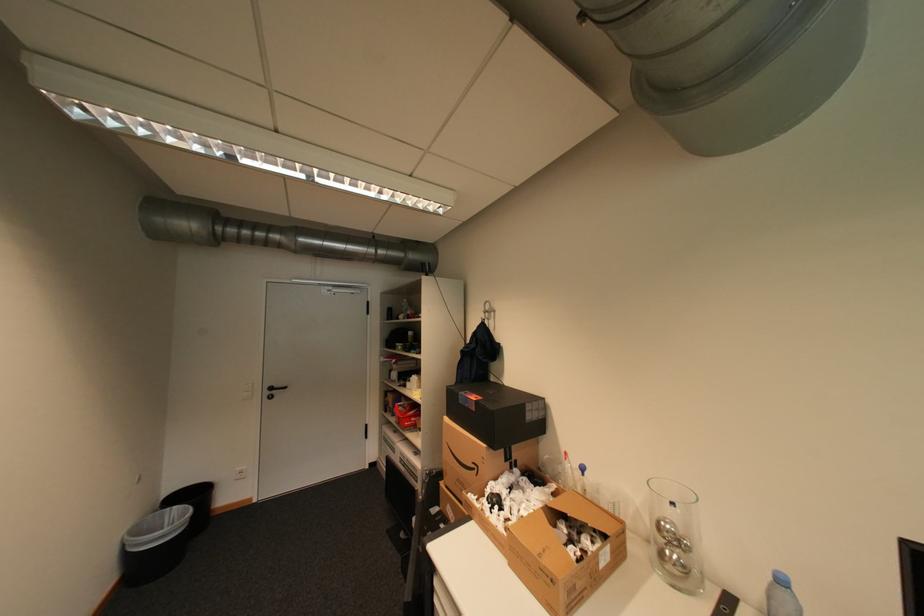
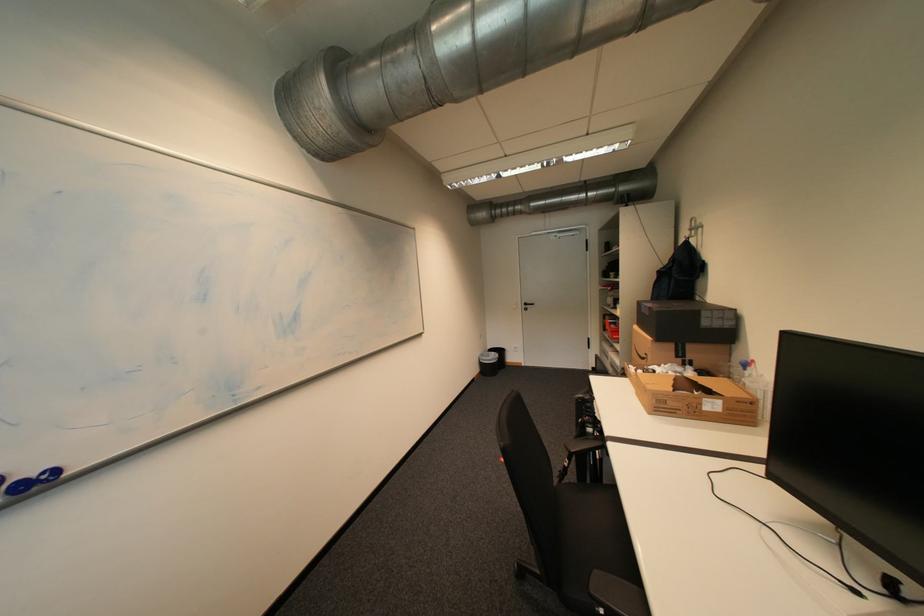
Question: How did the camera likely rotate?

Choices:
 (A) Left
 (B) Right
 (C) Up
 (D) Down

Answer: (A)